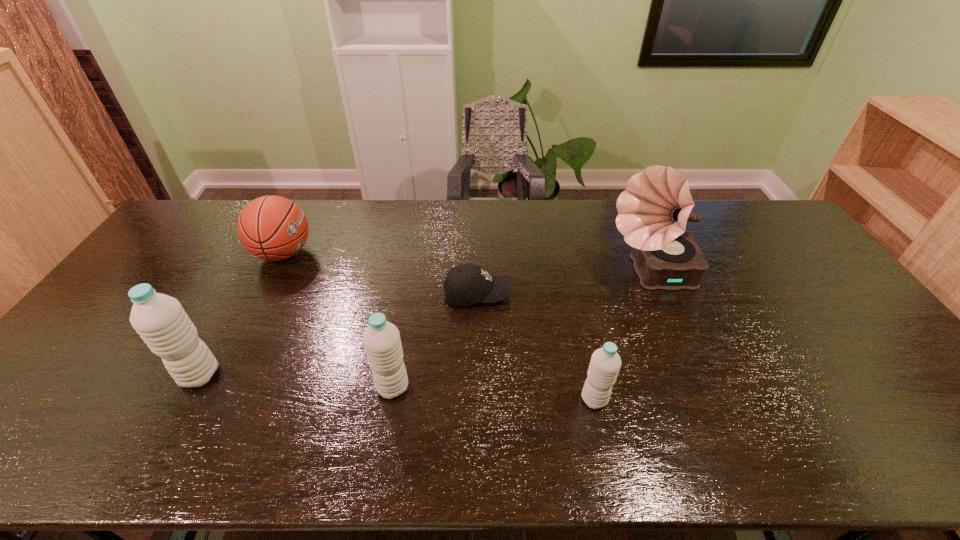
At what (x,y) coordinates should I click in order to perform the action: click on the leftmost water bottle. Please return your answer as a coordinate pair (x, y). This screenshot has height=540, width=960. Looking at the image, I should click on (159, 319).

You are a GUI agent. You are given a task and a screenshot of the screen. Output one action in this format:
    pyautogui.click(x=<x>, y=<y>)
    Task: Click on the second tallest object
    
    Given the screenshot: What is the action you would take?
    pyautogui.click(x=159, y=319)

Image resolution: width=960 pixels, height=540 pixels. In order to click on the third object from left to right in this screenshot , I will do `click(381, 339)`.

You are a GUI agent. You are given a task and a screenshot of the screen. Output one action in this format:
    pyautogui.click(x=<x>, y=<y>)
    Task: Click on the second shortest water bottle
    The width and height of the screenshot is (960, 540).
    Given the screenshot: What is the action you would take?
    pyautogui.click(x=381, y=339)

I want to click on the shortest water bottle, so click(605, 363).

I want to click on the rightmost water bottle, so click(x=605, y=363).

Where is `baseball cap`? This screenshot has height=540, width=960. baseball cap is located at coordinates (467, 284).

The width and height of the screenshot is (960, 540). I want to click on the fourth object from left to right, so click(x=467, y=284).

Image resolution: width=960 pixels, height=540 pixels. Find the location of `basketball`. basketball is located at coordinates (274, 228).

The width and height of the screenshot is (960, 540). Find the location of `record player`. record player is located at coordinates (654, 209).